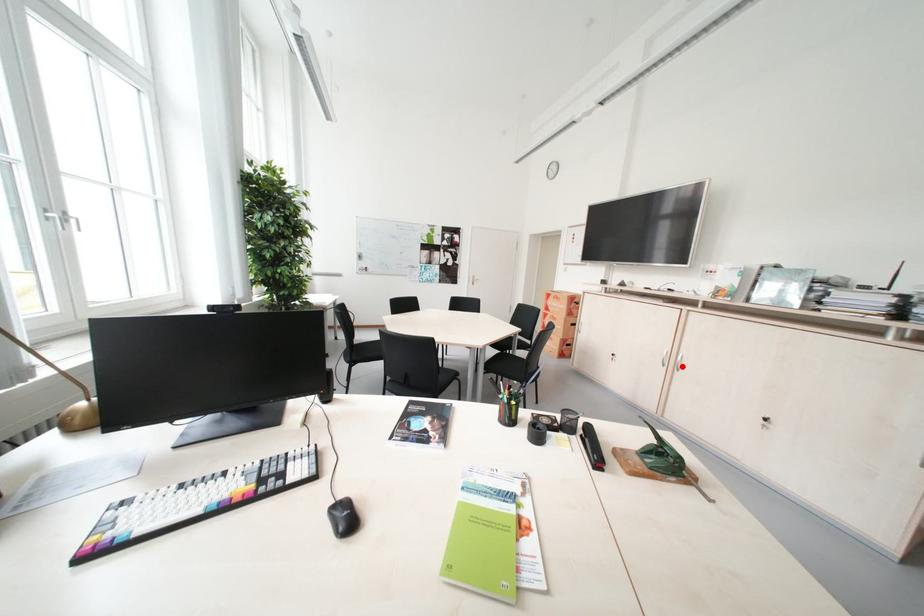
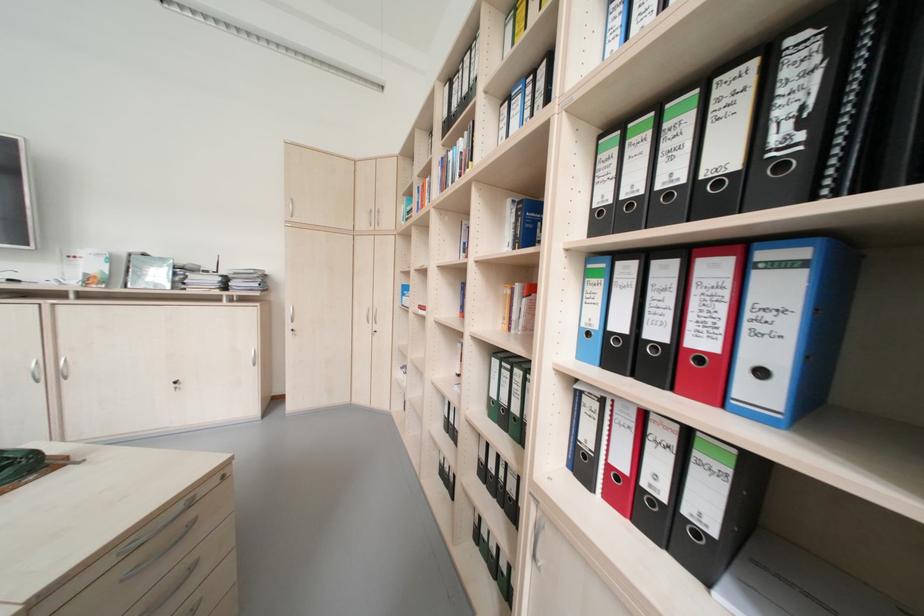
Where in the second image is the point corresponding to the highlighted location from the first image?

(65, 377)